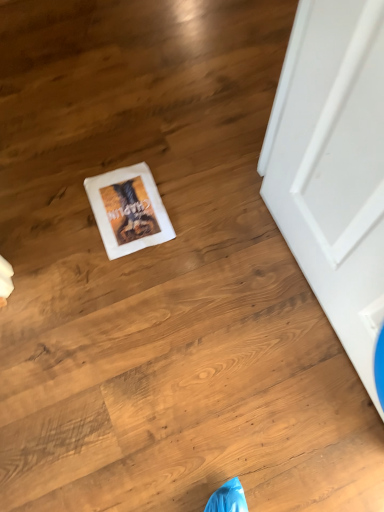
Question: Is white matte door at right bigger than white paper postcard at center?

Choices:
 (A) yes
 (B) no

Answer: (A)

Question: Can we say white matte door at right lies outside white paper postcard at center?

Choices:
 (A) no
 (B) yes

Answer: (B)

Question: Is the depth of white matte door at right less than that of white paper postcard at center?

Choices:
 (A) no
 (B) yes

Answer: (B)

Question: Does white matte door at right have a smaller size compared to white paper postcard at center?

Choices:
 (A) yes
 (B) no

Answer: (B)

Question: From the image's perspective, would you say white matte door at right is positioned over white paper postcard at center?

Choices:
 (A) no
 (B) yes

Answer: (A)

Question: Does white matte door at right have a greater height compared to white paper postcard at center?

Choices:
 (A) no
 (B) yes

Answer: (B)

Question: Is white paper postcard at center positioned far away from white matte door at right?

Choices:
 (A) no
 (B) yes

Answer: (A)

Question: Is white paper postcard at center directly adjacent to white matte door at right?

Choices:
 (A) yes
 (B) no

Answer: (B)

Question: Can you confirm if white paper postcard at center is wider than white matte door at right?

Choices:
 (A) no
 (B) yes

Answer: (B)

Question: Considering the relative positions of white paper postcard at center and white matte door at right in the image provided, is white paper postcard at center to the right of white matte door at right from the viewer's perspective?

Choices:
 (A) no
 (B) yes

Answer: (A)

Question: Does white paper postcard at center have a smaller size compared to white matte door at right?

Choices:
 (A) yes
 (B) no

Answer: (A)

Question: From a real-world perspective, is white paper postcard at center positioned under white matte door at right based on gravity?

Choices:
 (A) no
 (B) yes

Answer: (B)

Question: From their relative heights in the image, would you say white paper postcard at center is taller or shorter than white matte door at right?

Choices:
 (A) tall
 (B) short

Answer: (B)